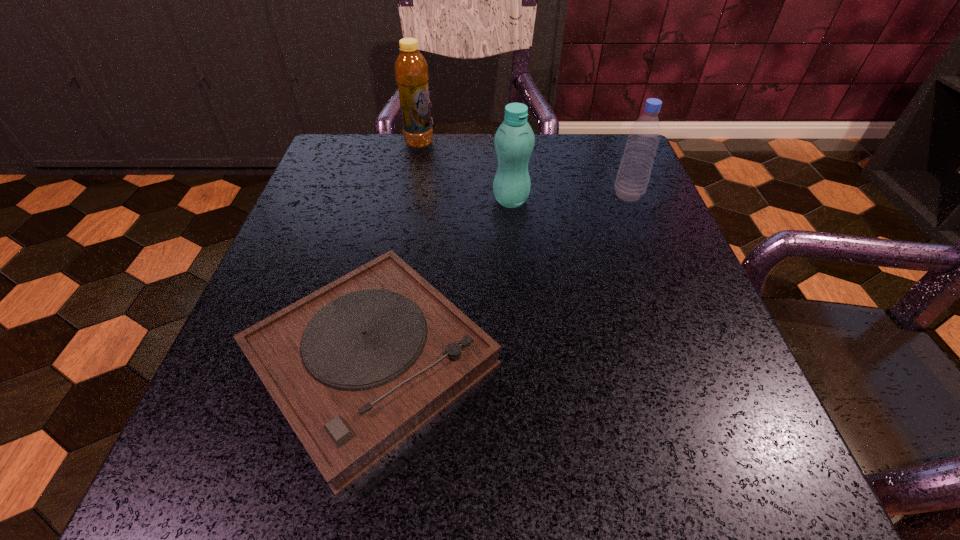
The height and width of the screenshot is (540, 960). What are the coordinates of `the leftmost bottle` in the screenshot? It's located at (411, 71).

I want to click on the farthest object, so click(x=411, y=71).

Where is `the rightmost object`? This screenshot has width=960, height=540. the rightmost object is located at coordinates (633, 175).

Locate an element on the screen. the second bottle from right to left is located at coordinates (514, 140).

Identify the location of the shortest object. This screenshot has width=960, height=540. (357, 367).

Where is `the nearest object`? This screenshot has height=540, width=960. the nearest object is located at coordinates point(357,367).

At what (x,y) coordinates should I click in order to perform the action: click on free point located 0.150m on the left of the farthest object. Please return your answer as a coordinate pair (x, y). Image resolution: width=960 pixels, height=540 pixels. Looking at the image, I should click on (342, 143).

At what (x,y) coordinates should I click in order to perform the action: click on blank space located 0.340m on the left of the rightmost bottle. Please return your answer as a coordinate pair (x, y). This screenshot has width=960, height=540. Looking at the image, I should click on (447, 195).

What are the coordinates of `vacant space located 0.160m on the back of the second bottle from right to left` in the screenshot? It's located at (507, 150).

I want to click on vacant area located 0.130m on the right of the nearest object, so click(x=591, y=360).